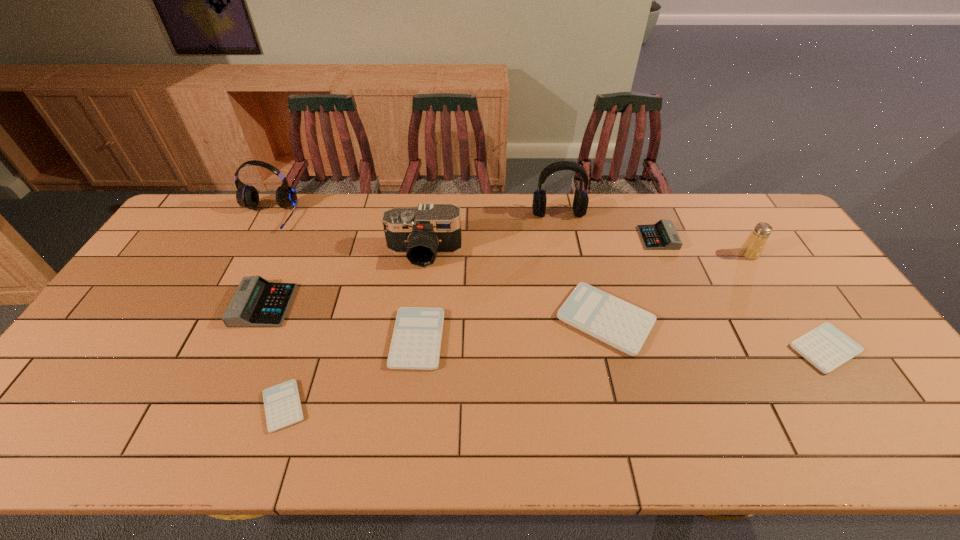
Locate an element on the screen. The height and width of the screenshot is (540, 960). free location located 0.150m on the front of the saltshaker is located at coordinates (775, 296).

What are the coordinates of `free space located 0.110m on the back of the leftmost calculator` in the screenshot? It's located at (284, 260).

At what (x,y) coordinates should I click in order to perform the action: click on vacant region located 0.080m on the right of the second tallest calculator. Please return your answer as a coordinate pair (x, y). This screenshot has width=960, height=540. Looking at the image, I should click on (699, 238).

You are a GUI agent. You are given a task and a screenshot of the screen. Output one action in this format:
    pyautogui.click(x=<x>, y=<y>)
    Task: Click on the free space located 0.200m on the left of the biggest white calculator
    The width and height of the screenshot is (960, 540).
    Given the screenshot: What is the action you would take?
    pyautogui.click(x=484, y=319)

Locate an element on the screen. vacant position located 0.180m on the back of the fourth calculator from right to left is located at coordinates (426, 265).

Where is `free spot located on the front of the fifth tallest calculator`? free spot located on the front of the fifth tallest calculator is located at coordinates (883, 437).

The image size is (960, 540). In order to click on free space located 0.260m on the back of the leftmost white calculator in this screenshot , I will do `click(319, 301)`.

Find the location of `calculator that is at the far edge`. calculator that is at the far edge is located at coordinates (662, 235).

This screenshot has width=960, height=540. I want to click on object situated at the near edge, so click(x=282, y=404).

Identify the location of saltshaker that is at the right edge. Image resolution: width=960 pixels, height=540 pixels. (752, 248).